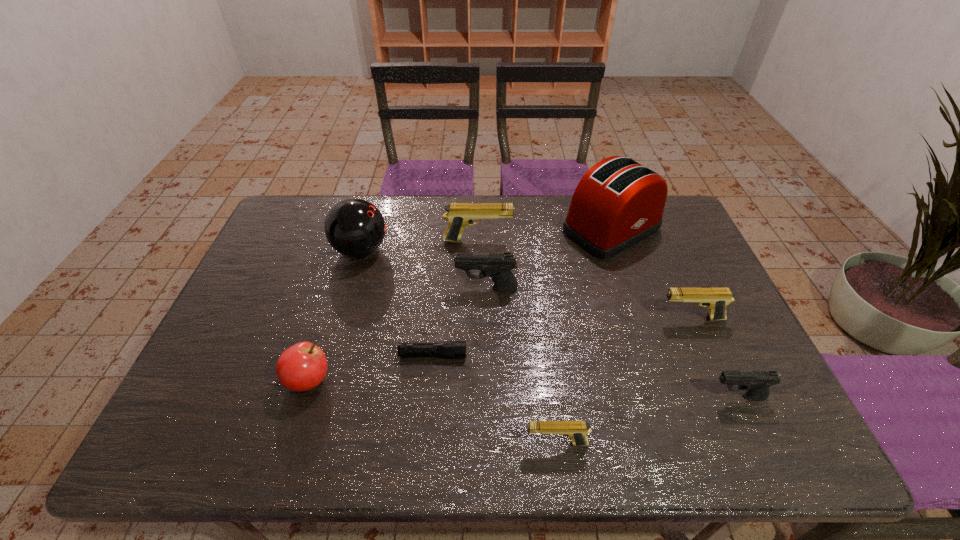
The height and width of the screenshot is (540, 960). I want to click on tan pistol object that ranks as the closest to the left black pistol, so click(459, 215).

Locate an element on the screen. vacant region that satisfies the following two spatial constraints: 1. on the front side of the tallest object; 2. at the barrel of the farther black pistol is located at coordinates (631, 289).

I want to click on vacant space that satisfies the following two spatial constraints: 1. on the front side of the red toaster; 2. on the surface of the bowling ball near the finger holes, so click(x=618, y=250).